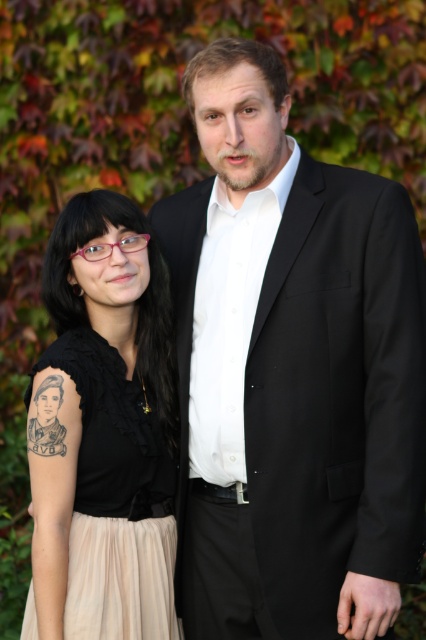
Is black smooth suit at center above black matte tattoo at left?

Indeed, black smooth suit at center is positioned over black matte tattoo at left.

Is point (270, 49) less distant than point (43, 481)?

No, it is behind (43, 481).

Image resolution: width=426 pixels, height=640 pixels. Identify the location of black smooth suit at center. (290, 372).